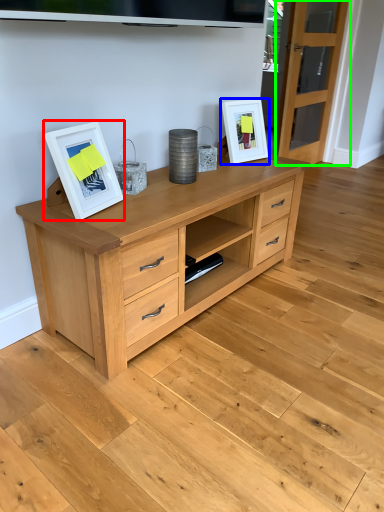
Question: Which object is the farthest from picture frame (highlighted by a red box)? Choose among these: picture frame (highlighted by a blue box) or glass door (highlighted by a green box).

Choices:
 (A) picture frame
 (B) glass door

Answer: (B)